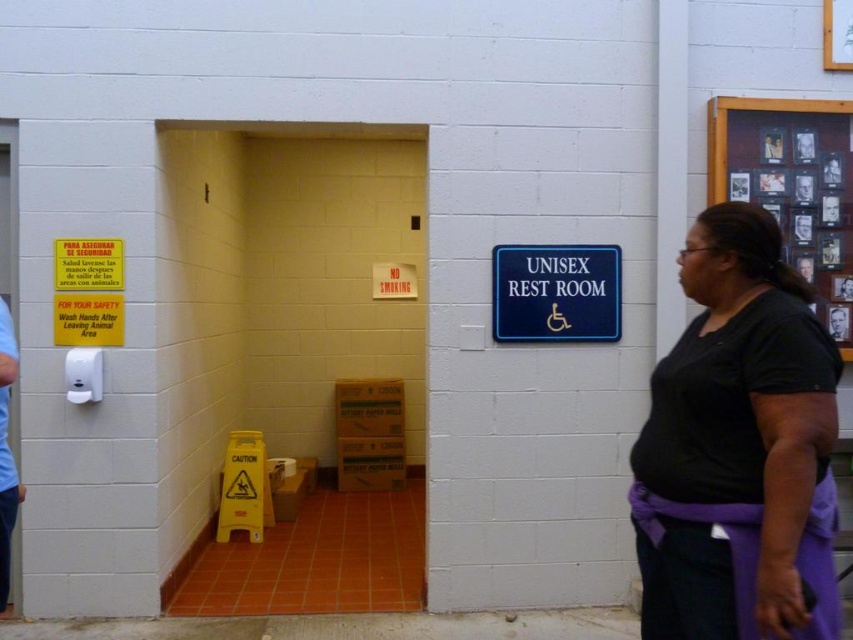
Question: Based on their relative distances, which object is farther from the wooden frame at upper right?

Choices:
 (A) black fabric shirt at right
 (B) light blue fabric at left
 (C) blue plastic sign at upper right
 (D) dark brown hair at upper left

Answer: (B)

Question: Is blue plastic sign at upper right closer to camera compared to light blue fabric at left?

Choices:
 (A) no
 (B) yes

Answer: (A)

Question: Which point is farther from the camera taking this photo?

Choices:
 (A) (9, 564)
 (B) (778, 273)
 (C) (833, 314)
 (D) (820, 200)

Answer: (D)

Question: Does black fabric shirt at right have a smaller size compared to blue plastic sign at upper right?

Choices:
 (A) no
 (B) yes

Answer: (A)

Question: Where is black fabric shirt at right located in relation to wooden frame at upper right in the image?

Choices:
 (A) left
 (B) right

Answer: (A)

Question: Among these points, which one is farthest from the camera?

Choices:
 (A) (833, 320)
 (B) (514, 275)

Answer: (A)